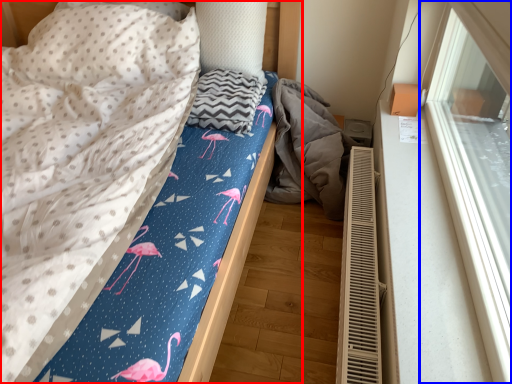
Question: Which point is closer to the camera, bed (highlighted by a red box) or window (highlighted by a blue box)?

Choices:
 (A) bed
 (B) window

Answer: (B)